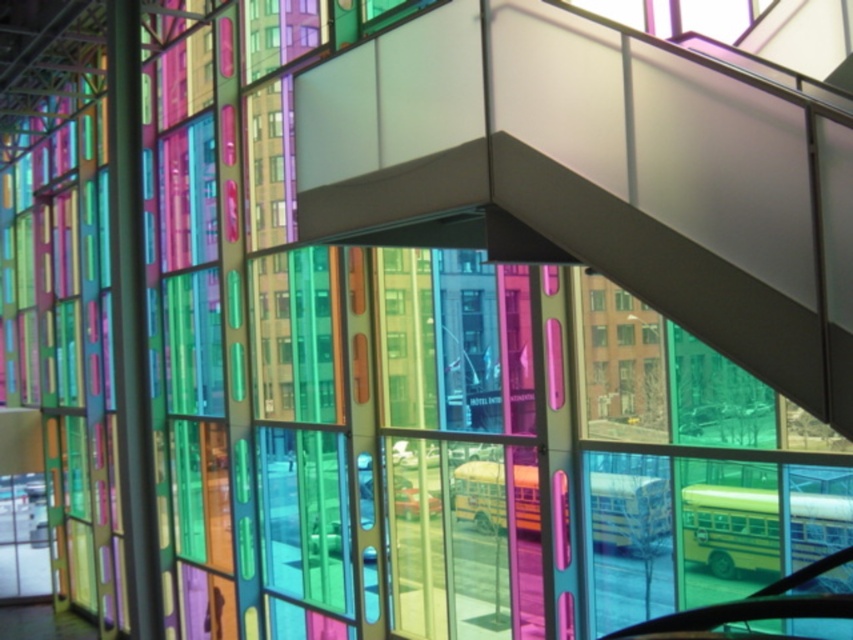
Is point (700, 528) farther from camera compared to point (637, 552)?

No, it is in front of (637, 552).

Can you confirm if yellow matte school bus at lower right is smaller than yellow matte school bus at center?

No, yellow matte school bus at lower right is not smaller than yellow matte school bus at center.

Locate an element on the screen. The image size is (853, 640). yellow matte school bus at lower right is located at coordinates (730, 529).

Where is `yellow matte school bus at lower right`? The image size is (853, 640). yellow matte school bus at lower right is located at coordinates (730, 529).